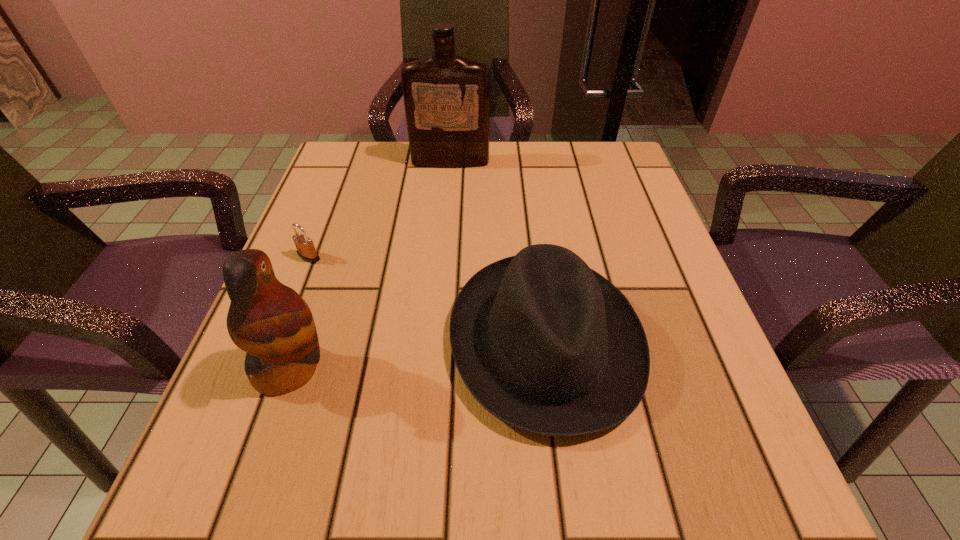
At what (x,y) coordinates should I click in order to perform the action: click on the closest object to the parrot. Please return your answer as a coordinate pair (x, y). Looking at the image, I should click on (306, 250).

The width and height of the screenshot is (960, 540). I want to click on object that is the second closest to the third tallest object, so click(306, 250).

The height and width of the screenshot is (540, 960). What are the coordinates of `vacant space that satisfies the following two spatial constraints: 1. on the label side of the tallest object; 2. on the right side of the second shortest object` in the screenshot? It's located at (435, 341).

Locate an element on the screen. free region that satisfies the following two spatial constraints: 1. on the label side of the second shortest object; 2. on the right side of the liquor is located at coordinates (435, 341).